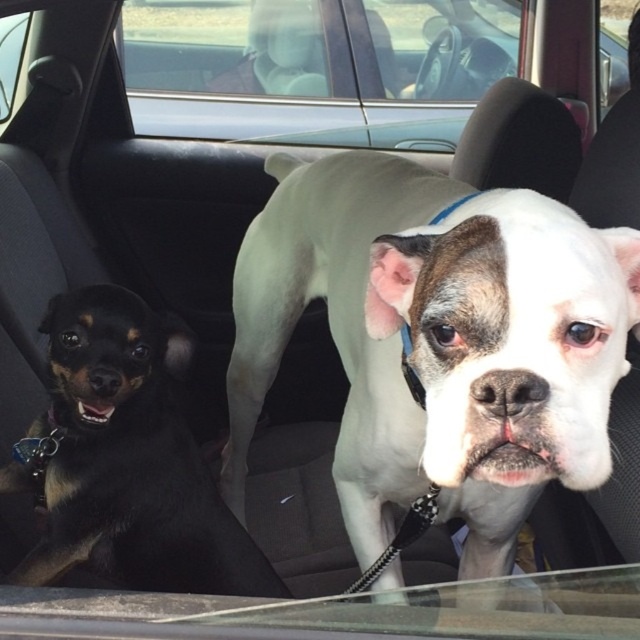
Question: Which of the following is the closest to the observer?

Choices:
 (A) (515, 317)
 (B) (74, 557)

Answer: (A)

Question: Is the position of white smooth dog at center more distant than that of black smooth dog at left?

Choices:
 (A) yes
 (B) no

Answer: (B)

Question: Is white smooth dog at center above black smooth dog at left?

Choices:
 (A) yes
 (B) no

Answer: (A)

Question: Which object is closer to the camera taking this photo?

Choices:
 (A) black smooth dog at left
 (B) white smooth dog at center

Answer: (B)

Question: Where is white smooth dog at center located in relation to black smooth dog at left in the image?

Choices:
 (A) below
 (B) above

Answer: (B)